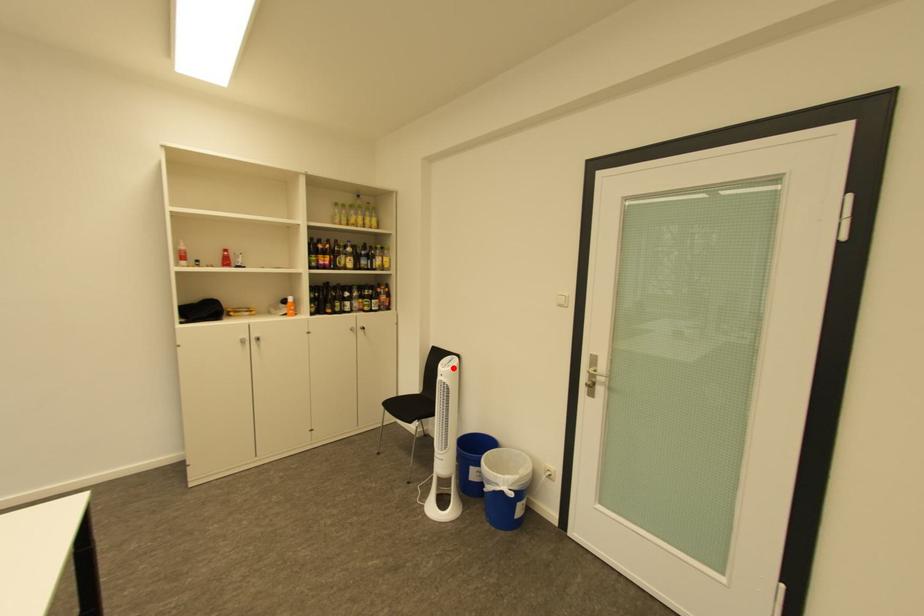
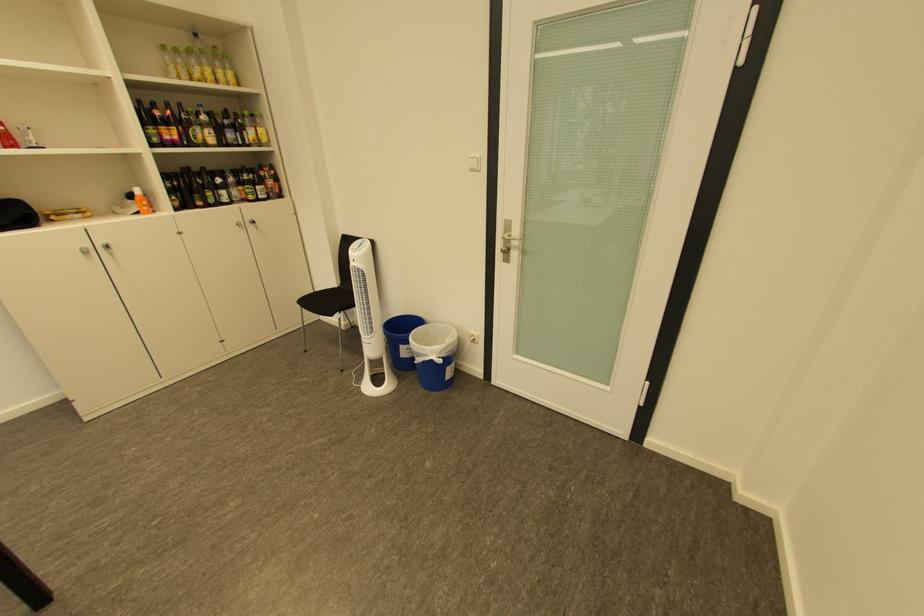
The point at the highlighted location is marked in the first image. Where is the corresponding point in the second image?

(363, 253)